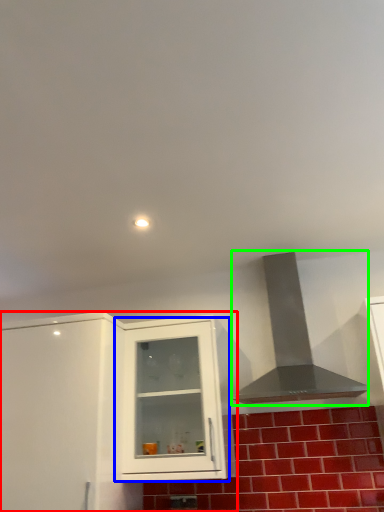
Question: Based on their relative distances, which object is farther from cabinetry (highlighted by a red box)? Choose from cabinetry (highlighted by a blue box) and vent (highlighted by a green box).

Choices:
 (A) cabinetry
 (B) vent

Answer: (B)